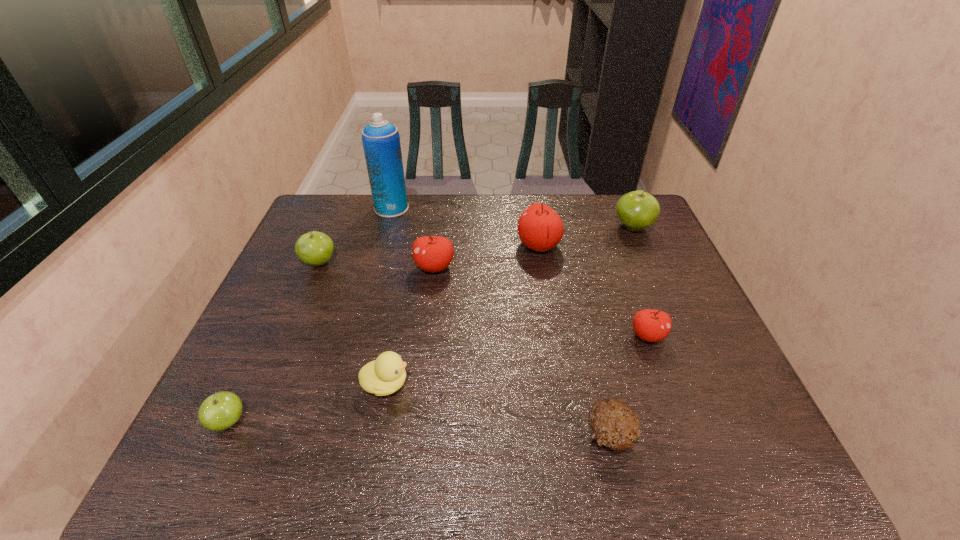
You are a GUI agent. You are given a task and a screenshot of the screen. Output one action in this format:
    pyautogui.click(x=<x>, y=<y>)
    Task: Click on the aerosol can
    
    Given the screenshot: What is the action you would take?
    pyautogui.click(x=381, y=142)

This screenshot has width=960, height=540. I want to click on the third apple from right to left, so click(x=540, y=228).

The width and height of the screenshot is (960, 540). What are the coordinates of `the second red apple from left to right` in the screenshot? It's located at (540, 228).

The image size is (960, 540). Identify the location of the biggest green apple. (637, 210).

This screenshot has height=540, width=960. I want to click on the rightmost green apple, so click(x=637, y=210).

Identify the location of the fourth apple from right to left. The height and width of the screenshot is (540, 960). (431, 253).

Where is `the leftmost red apple`? the leftmost red apple is located at coordinates (431, 253).

Identify the location of the second smallest green apple. This screenshot has height=540, width=960. (314, 248).

Find the location of a particular element. The height and width of the screenshot is (540, 960). the seventh farthest object is located at coordinates (385, 375).

Where is `duckling`? duckling is located at coordinates (385, 375).